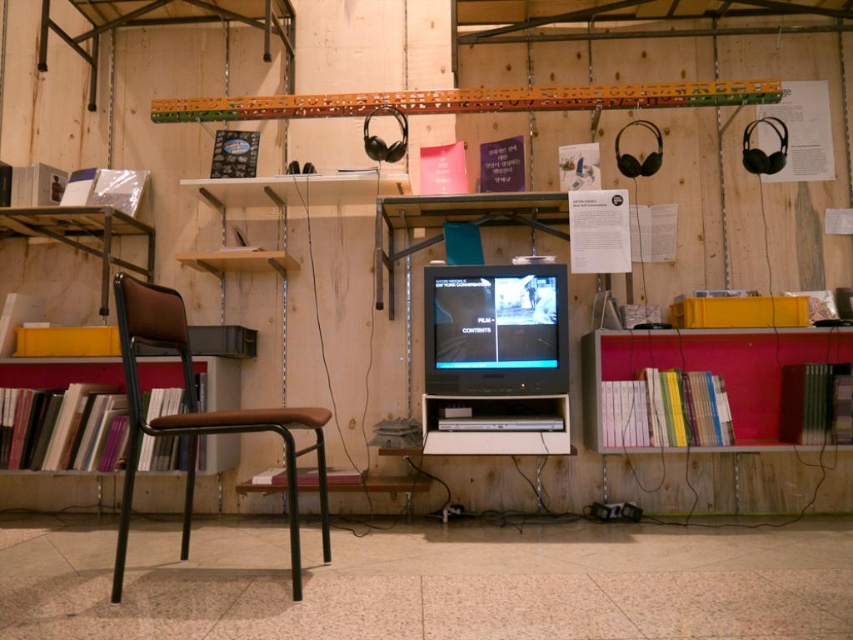
You are setting up a new monitor in the workspace. The matte black monitor at center currently has a width of 20 inches. If the wooden bookshelf at left is 30 inches wide, can the monitor fit on the shelf without needing to adjust the shelf size?

The matte black monitor at center is narrower than the wooden bookshelf at left, so it can fit on the shelf without adjustments.